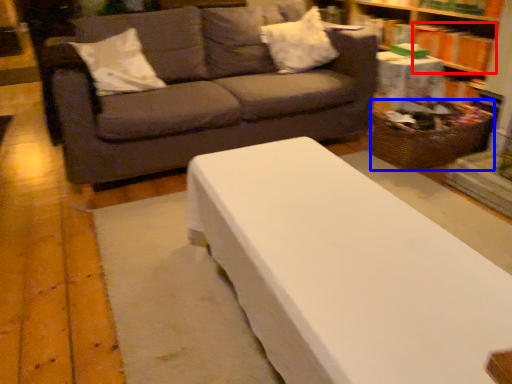
Question: Among these objects, which one is nearest to the camera, book (highlighted by a red box) or basket (highlighted by a blue box)?

Choices:
 (A) book
 (B) basket

Answer: (B)